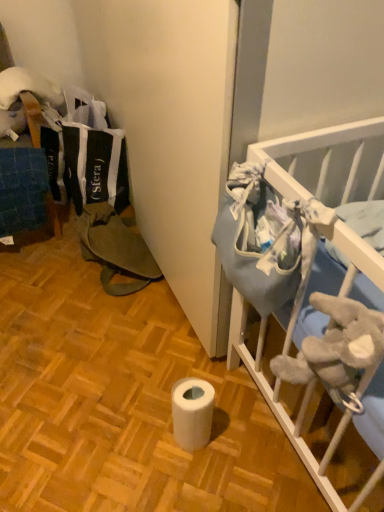
Identify the location of free point to the left of white matte toilet paper at center. The height and width of the screenshot is (512, 384). click(x=134, y=437).